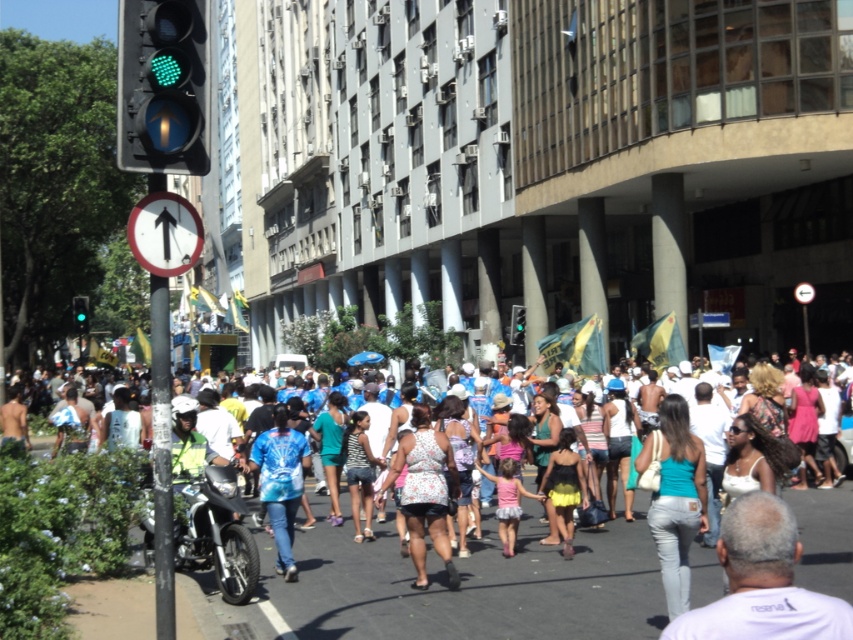
Looking at this image, is white cotton shirt at center positioned at the back of tie-dye shirt at center?

Yes, it is.

Between white cotton shirt at center and tie-dye shirt at center, which one has more height?

tie-dye shirt at center is taller.

Which is in front, point (366, 554) or point (282, 481)?

Point (282, 481) is in front.

This screenshot has height=640, width=853. In order to click on white cotton shirt at center in this screenshot , I will do `click(473, 586)`.

Is point (683, 472) farther from camera compared to point (444, 504)?

No, (683, 472) is in front of (444, 504).

Can you confirm if denim jeans at center is wider than floral print dress at center?

In fact, denim jeans at center might be narrower than floral print dress at center.

Which is in front, point (670, 413) or point (437, 468)?

Point (670, 413) is in front.

Locate an element on the screen. denim jeans at center is located at coordinates point(677,500).

In the scene shown: Which of these two, white matte shirt at lower right or green glass traffic light at left, stands taller?

With more height is green glass traffic light at left.

How far apart are white matte shirt at lower right and green glass traffic light at left?

white matte shirt at lower right is 43.46 meters away from green glass traffic light at left.

Does point (752, 566) come in front of point (84, 308)?

Yes, it is.

This screenshot has height=640, width=853. I want to click on white matte shirt at lower right, so click(762, 580).